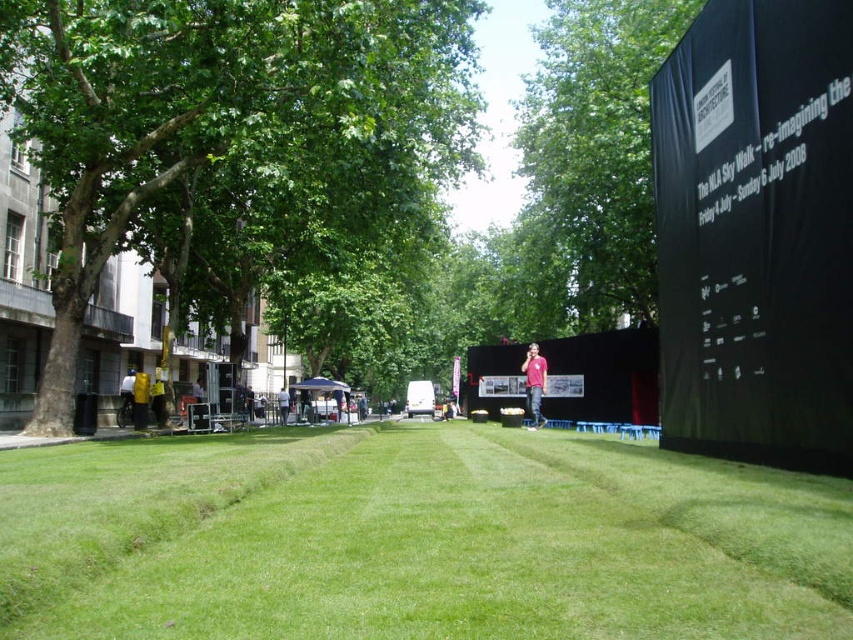
You are standing at the grassy area and want to walk to the point marked as point (640, 262). There is an obstacle at point (216, 173). Will you encounter this obstacle before reaching your destination?

Yes, you will encounter the obstacle at point (216, 173) before reaching point (640, 262) because point (216, 173) is in front of point (640, 262).

You are standing in the park and want to take a photo of both the green grass at center and the green leafy tree at left. Which object should you focus on first to ensure both are in clear view?

You should focus on the green grass at center first because it is closer to the viewer than the green leafy tree at left, so adjusting focus starting from the closer object will help both be in clear view.

You are planning to set up a picnic blanket in the park. Considering the green leafy tree at left and the green leafy tree at upper center, which tree would provide more shade coverage for your picnic area?

The green leafy tree at left might provide more shade coverage because it is wider than the green leafy tree at upper center.